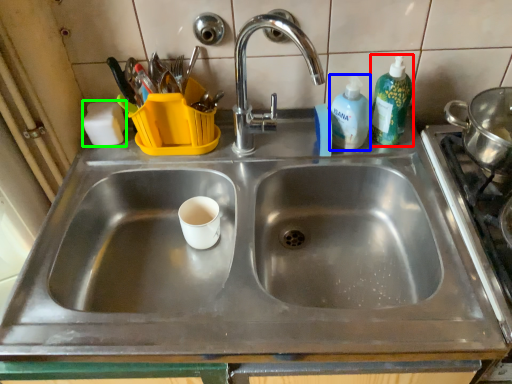
Question: Which is nearer to the cleaning product (highlighted by a red box)? cleaning product (highlighted by a blue box) or soap (highlighted by a green box).

Choices:
 (A) cleaning product
 (B) soap

Answer: (A)